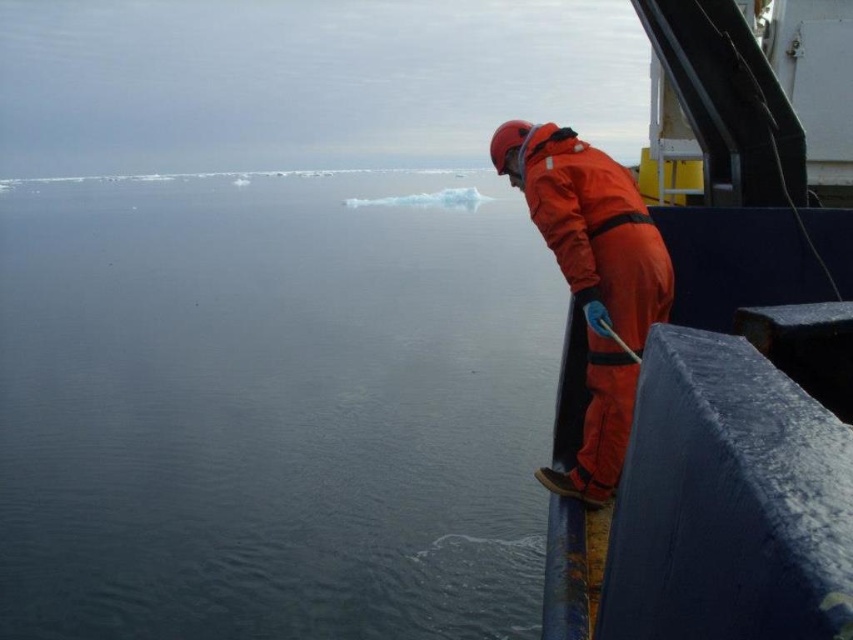
You are a crew member on the ship and need to retrieve an object that fell into the water. The object is floating on the dark blue water at center. Can you reach it from the ship without getting into the orange fabric boat at right?

The dark blue water at center is above the orange fabric boat at right, meaning the water is higher in elevation. Since the object is floating on the dark blue water at center, you can reach it directly from the ship without needing to use the orange fabric boat at right.

You are on a ship in a cold environment. You see a point marked at coordinates (727, 385). What object is located at that point?

The point at coordinates (727, 385) corresponds to the orange fabric boat at right.

You are a sailor on the ship and need to determine if the orange fabric boat at right can safely dock at the dark blue water at center. Based on their relative heights, can the boat dock there?

The dark blue water at center is taller than the orange fabric boat at right, meaning the water level is higher than the boat. This would make docking unsafe as the boat could be submerged or damaged by the higher water level.